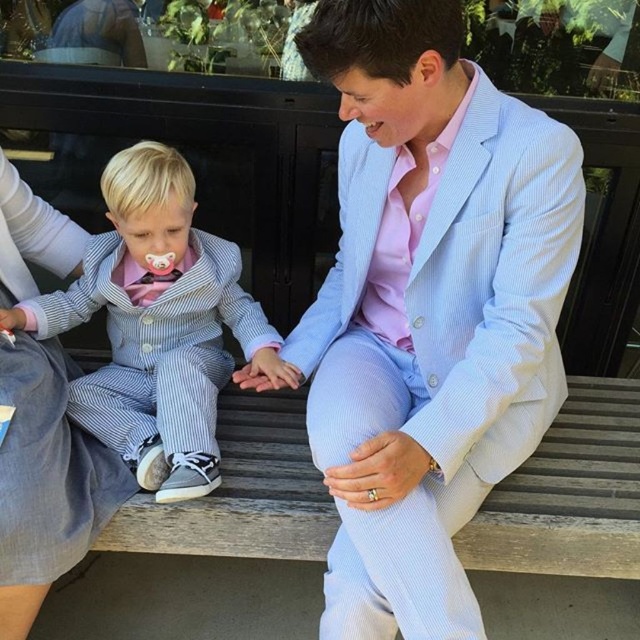
Question: In this image, where is light blue seersucker suit at center located relative to striped fabric suit at left?

Choices:
 (A) right
 (B) left

Answer: (A)

Question: Which of the following is the farthest from the observer?

Choices:
 (A) (516, 364)
 (B) (60, 492)

Answer: (B)

Question: Can you confirm if striped fabric suit at left is wider than light blue striped suit at center?

Choices:
 (A) no
 (B) yes

Answer: (B)

Question: Which of the following is the farthest from the observer?

Choices:
 (A) (108, 196)
 (B) (342, 337)

Answer: (B)

Question: Does light blue seersucker suit at center appear on the left side of striped fabric suit at left?

Choices:
 (A) yes
 (B) no

Answer: (B)

Question: Among these objects, which one is farthest from the camera?

Choices:
 (A) striped fabric suit at left
 (B) light blue seersucker suit at center

Answer: (A)